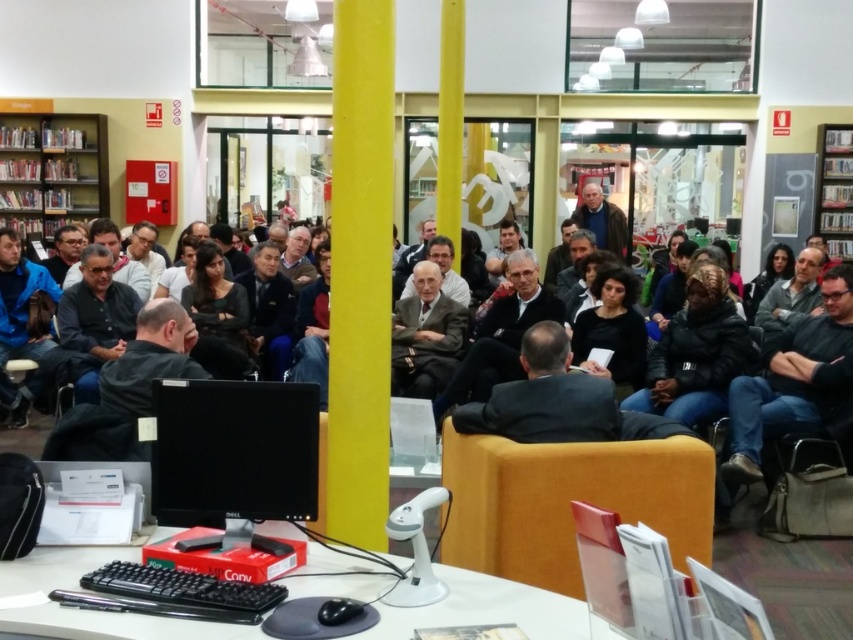
Which is below, black plastic table at lower center or metallic silver bookshelf at upper right?

black plastic table at lower center is below.

Between point (158, 528) and point (819, 204), which one is positioned in front?

Point (158, 528) is more forward.

Image resolution: width=853 pixels, height=640 pixels. What do you see at coordinates (486, 609) in the screenshot?
I see `black plastic table at lower center` at bounding box center [486, 609].

Image resolution: width=853 pixels, height=640 pixels. Find the location of `black plastic table at lower center`. black plastic table at lower center is located at coordinates (486, 609).

Between metallic silver bookshelf at upper right and matte gray sweater at upper center, which one is positioned lower?

Positioned lower is matte gray sweater at upper center.

Which is behind, point (830, 180) or point (607, 205)?

The point (607, 205) is more distant.

Is point (848, 168) positioned behind point (618, 241)?

No, it is in front of (618, 241).

Find the location of `metallic silver bookshelf at upper right`. metallic silver bookshelf at upper right is located at coordinates (834, 189).

Describe the element at coordinates (793, 378) in the screenshot. The width and height of the screenshot is (853, 640). I see `black leather jacket at lower right` at that location.

Is black leather jacket at lower right positioned in front of matte gray sweater at upper center?

Yes, it is in front of matte gray sweater at upper center.

You are a GUI agent. You are given a task and a screenshot of the screen. Output one action in this format:
    pyautogui.click(x=<x>, y=<y>)
    Task: Click on the black leather jacket at lower right
    
    Given the screenshot: What is the action you would take?
    pyautogui.click(x=793, y=378)